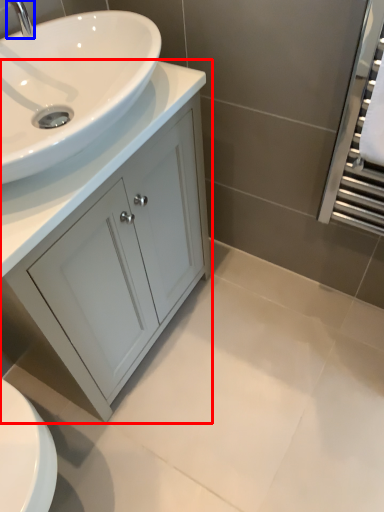
Question: Which of the following is the closest to the observer, bathroom cabinet (highlighted by a red box) or tap (highlighted by a blue box)?

Choices:
 (A) bathroom cabinet
 (B) tap

Answer: (B)